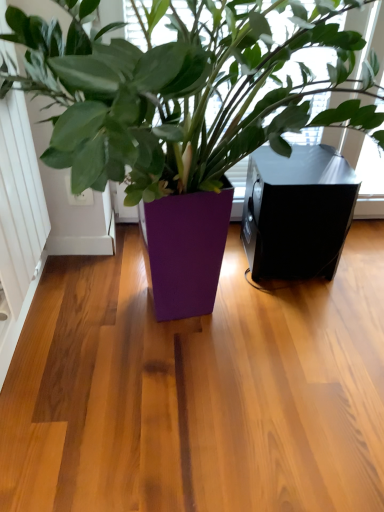
Image resolution: width=384 pixels, height=512 pixels. What do you see at coordinates (19, 222) in the screenshot?
I see `white matte screen door at left` at bounding box center [19, 222].

This screenshot has width=384, height=512. I want to click on purple glossy planter at center, so click(x=181, y=92).

Is black matte speaker at right positioned behind purple glossy planter at center?

Yes, black matte speaker at right is further from the camera.

Can you tell me how much black matte speaker at right and purple glossy planter at center differ in facing direction?

black matte speaker at right and purple glossy planter at center are facing 1.71e-05 degrees away from each other.

Considering the relative positions of black matte speaker at right and purple glossy planter at center in the image provided, is black matte speaker at right to the left or to the right of purple glossy planter at center?

black matte speaker at right is to the right of purple glossy planter at center.

What's the angular difference between purple glossy planter at center and black matte speaker at right's facing directions?

They differ by 1.71e-05 degrees in their facing directions.

Is purple glossy planter at center facing away from black matte speaker at right?

Correct, purple glossy planter at center is looking away from black matte speaker at right.

Between purple glossy planter at center and black matte speaker at right, which one has less height?

black matte speaker at right is shorter.

Based on the photo, relative to black matte speaker at right, is purple glossy planter at center in front or behind?

Visually, purple glossy planter at center is located in front of black matte speaker at right.

From the image's perspective, which one is positioned lower, black matte speaker at right or white matte screen door at left?

black matte speaker at right, from the image's perspective.

Choose the correct answer: Is black matte speaker at right inside white matte screen door at left or outside it?

The correct answer is: outside.

Considering the positions of point (248, 225) and point (22, 127), is point (248, 225) closer or farther from the camera than point (22, 127)?

Point (248, 225) is farther from the camera than point (22, 127).

Looking at the image, does black matte speaker at right seem bigger or smaller compared to white matte screen door at left?

black matte speaker at right is bigger than white matte screen door at left.

How far apart are white matte screen door at left and purple glossy planter at center?

A distance of 17.51 inches exists between white matte screen door at left and purple glossy planter at center.

Visually, is white matte screen door at left positioned to the left or to the right of purple glossy planter at center?

Based on their positions, white matte screen door at left is located to the left of purple glossy planter at center.

Based on the photo, considering the sizes of objects white matte screen door at left and purple glossy planter at center in the image provided, who is wider, white matte screen door at left or purple glossy planter at center?

Wider between the two is purple glossy planter at center.

Is white matte screen door at left in front of or behind purple glossy planter at center in the image?

white matte screen door at left is behind purple glossy planter at center.

Which of these two, purple glossy planter at center or white matte screen door at left, stands taller?

purple glossy planter at center.

From the image's perspective, is purple glossy planter at center located above or below white matte screen door at left?

Based on their image positions, purple glossy planter at center is located beneath white matte screen door at left.

This screenshot has height=512, width=384. In the image, there is a white matte screen door at left. Find the location of `houseplant below it (from the image's perspective)`. houseplant below it (from the image's perspective) is located at coordinates (181, 92).

Is white matte screen door at left not inside black matte speaker at right?

Absolutely, white matte screen door at left is external to black matte speaker at right.

Can you confirm if white matte screen door at left is taller than black matte speaker at right?

Yes.

Does point (37, 170) appear closer or farther from the camera than point (275, 208)?

Point (37, 170).

Is white matte screen door at left wider or thinner than black matte speaker at right?

In the image, white matte screen door at left appears to be more narrow than black matte speaker at right.

You are a GUI agent. You are given a task and a screenshot of the screen. Output one action in this format:
    pyautogui.click(x=<x>, y=<y>)
    Task: Click on the houseplant that appears in front of the black matte speaker at right
    
    Given the screenshot: What is the action you would take?
    pyautogui.click(x=181, y=92)

Locate an element on the screen. The height and width of the screenshot is (512, 384). speaker lying behind the purple glossy planter at center is located at coordinates (297, 212).

When comparing their distances from purple glossy planter at center, does black matte speaker at right or white matte screen door at left seem further?

white matte screen door at left lies further to purple glossy planter at center than the other object.

When comparing their distances from white matte screen door at left, does purple glossy planter at center or black matte speaker at right seem closer?

purple glossy planter at center is closer to white matte screen door at left.

Which object lies further to the anchor point black matte speaker at right, purple glossy planter at center or white matte screen door at left?

white matte screen door at left is further to black matte speaker at right.

From the image, which object appears to be nearer to purple glossy planter at center, white matte screen door at left or black matte speaker at right?

black matte speaker at right is closer to purple glossy planter at center.

From the image, which object appears to be farther from black matte speaker at right, white matte screen door at left or purple glossy planter at center?

white matte screen door at left is further to black matte speaker at right.

Considering their positions, is black matte speaker at right positioned further to white matte screen door at left than purple glossy planter at center?

black matte speaker at right is positioned further to the anchor white matte screen door at left.

What are the coordinates of `screen door between purple glossy planter at center and black matte speaker at right from front to back` in the screenshot? It's located at (19, 222).